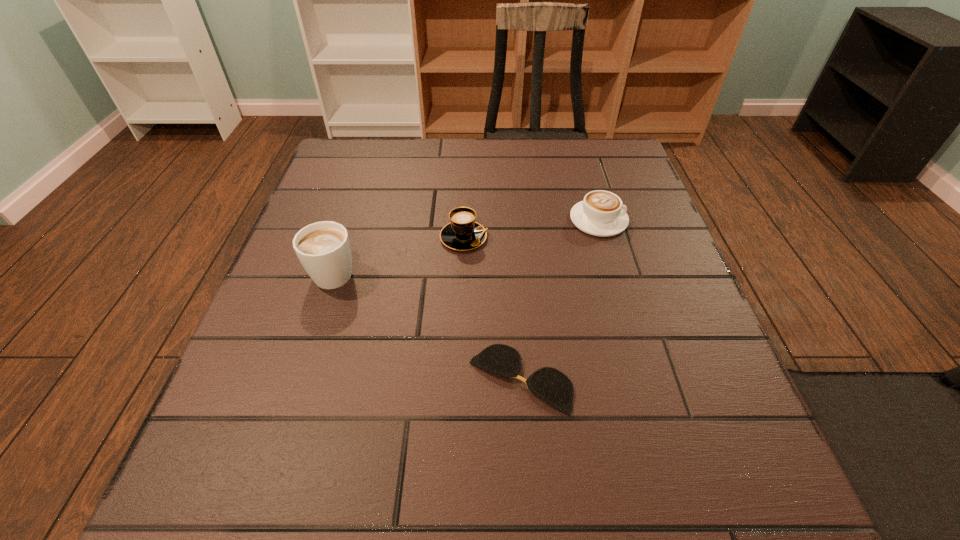
Where is `the leftmost cappuccino`? the leftmost cappuccino is located at coordinates (323, 248).

Locate an element on the screen. the tallest object is located at coordinates (323, 248).

You are a GUI agent. You are given a task and a screenshot of the screen. Output one action in this format:
    pyautogui.click(x=<x>, y=<y>)
    Task: Click on the second cappuccino from right to left
    
    Given the screenshot: What is the action you would take?
    pyautogui.click(x=463, y=233)

Where is `the rightmost object`? the rightmost object is located at coordinates (600, 213).

Find the location of a particular element. The image size is (960, 540). the shortest object is located at coordinates (551, 385).

At what (x,y) coordinates should I click in order to perform the action: click on spectacles. Please return your answer as a coordinate pair (x, y). Looking at the image, I should click on (551, 385).

Image resolution: width=960 pixels, height=540 pixels. Find the location of `vacant space positioned with the handle on the side of the tallest cappuccino`. vacant space positioned with the handle on the side of the tallest cappuccino is located at coordinates (365, 176).

Locate an element on the screen. This screenshot has width=960, height=540. free space located with the handle on the side of the tallest cappuccino is located at coordinates (353, 213).

Locate an element on the screen. The height and width of the screenshot is (540, 960). free space located with the handle on the side of the tallest cappuccino is located at coordinates (372, 157).

Locate an element on the screen. vacant region located 0.100m on the front of the second cappuccino from right to left is located at coordinates (462, 289).